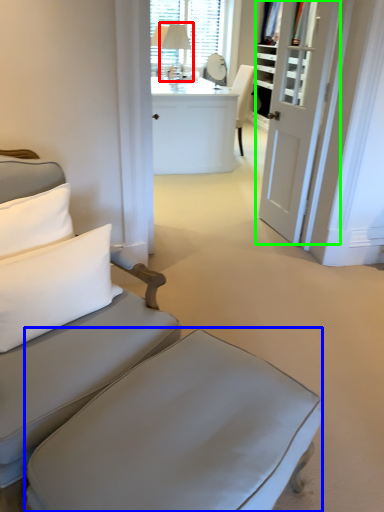
Question: Which object is positioned farthest from table lamp (highlighted by a red box)? Select from table (highlighted by a blue box) and door (highlighted by a green box).

Choices:
 (A) table
 (B) door

Answer: (A)